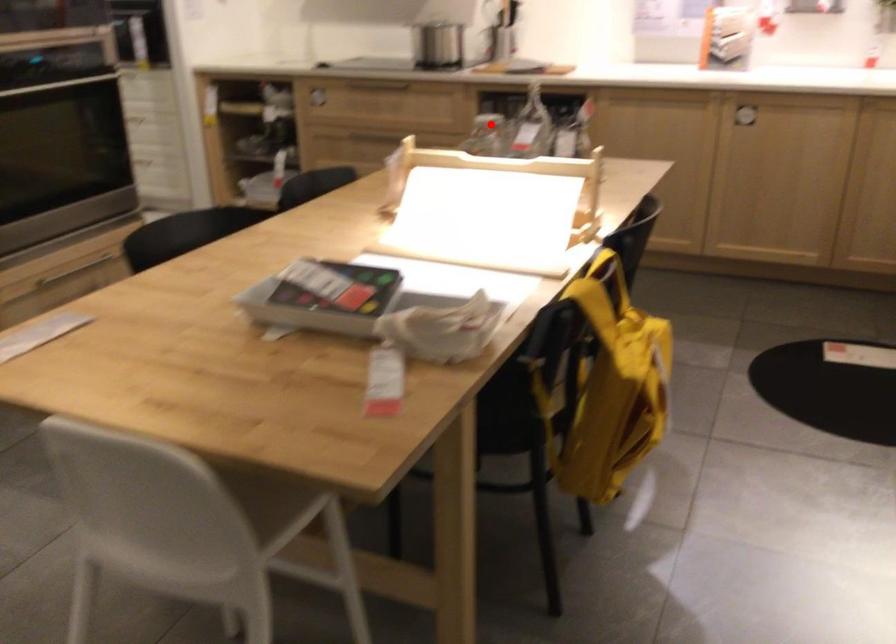
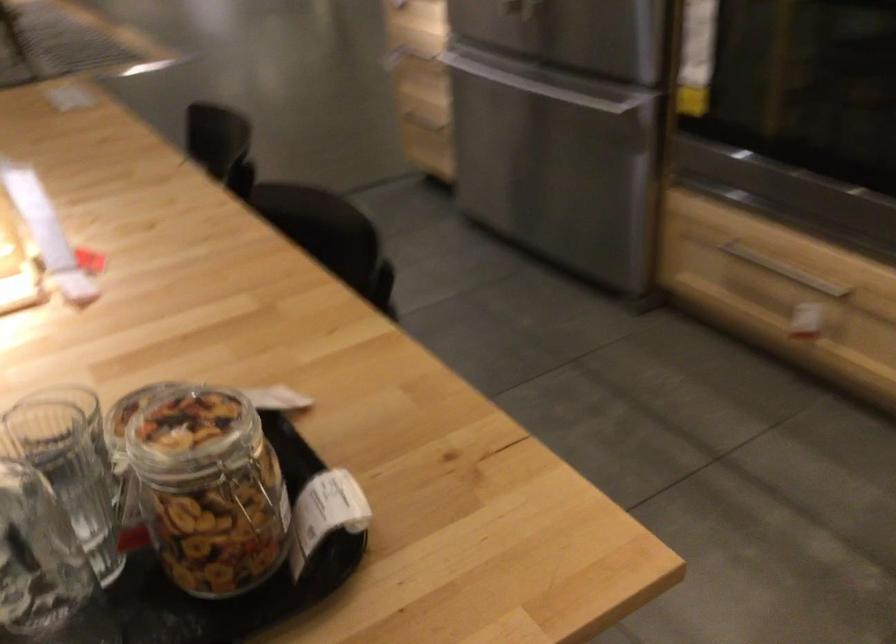
Question: I am providing you with two images of the same scene from different viewpoints. A red point is marked on the first image. Is the red point's position out of view in image 2?

Choices:
 (A) Yes
 (B) No

Answer: (B)